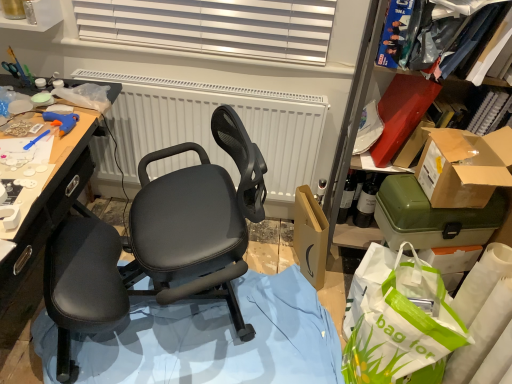
Question: Is matte black office chair at center facing towards brown cardboard box at right, which appears as the first box when viewed from the top?

Choices:
 (A) no
 (B) yes

Answer: (A)

Question: Can we say matte black office chair at center lies outside brown cardboard box at right, which appears as the first box when viewed from the top?

Choices:
 (A) no
 (B) yes

Answer: (B)

Question: Does matte black office chair at center have a lesser width compared to brown cardboard box at right, which is the 2th box from bottom to top?

Choices:
 (A) yes
 (B) no

Answer: (B)

Question: Considering the relative positions of matte black office chair at center and brown cardboard box at right, which appears as the first box when viewed from the top, in the image provided, is matte black office chair at center behind brown cardboard box at right, which appears as the first box when viewed from the top,?

Choices:
 (A) no
 (B) yes

Answer: (A)

Question: Considering the relative sizes of matte black office chair at center and brown cardboard box at right, which appears as the first box when viewed from the top, in the image provided, is matte black office chair at center bigger than brown cardboard box at right, which appears as the first box when viewed from the top,?

Choices:
 (A) no
 (B) yes

Answer: (B)

Question: Is matte black office chair at center shorter than brown cardboard box at right, which appears as the first box when viewed from the top?

Choices:
 (A) yes
 (B) no

Answer: (B)

Question: Does brown cardboard box at right, which is the 2th box from bottom to top, have a lesser height compared to matte black office chair at center?

Choices:
 (A) yes
 (B) no

Answer: (A)

Question: Considering the relative sizes of brown cardboard box at right, which is the 2th box from bottom to top, and matte black office chair at center in the image provided, is brown cardboard box at right, which is the 2th box from bottom to top, smaller than matte black office chair at center?

Choices:
 (A) no
 (B) yes

Answer: (B)

Question: Can you confirm if brown cardboard box at right, which is the 2th box from bottom to top, is taller than matte black office chair at center?

Choices:
 (A) no
 (B) yes

Answer: (A)

Question: Considering the relative sizes of brown cardboard box at right, which appears as the first box when viewed from the top, and matte black office chair at center in the image provided, is brown cardboard box at right, which appears as the first box when viewed from the top, wider than matte black office chair at center?

Choices:
 (A) yes
 (B) no

Answer: (B)

Question: Can you confirm if brown cardboard box at right, which is the 2th box from bottom to top, is thinner than matte black office chair at center?

Choices:
 (A) yes
 (B) no

Answer: (A)

Question: Could matte black office chair at center be considered to be inside brown cardboard box at right, which appears as the first box when viewed from the top?

Choices:
 (A) no
 (B) yes

Answer: (A)

Question: From a real-world perspective, is green plastic container at right, marked as the first box in a bottom-to-top arrangement, below white textured radiator at center?

Choices:
 (A) no
 (B) yes

Answer: (A)